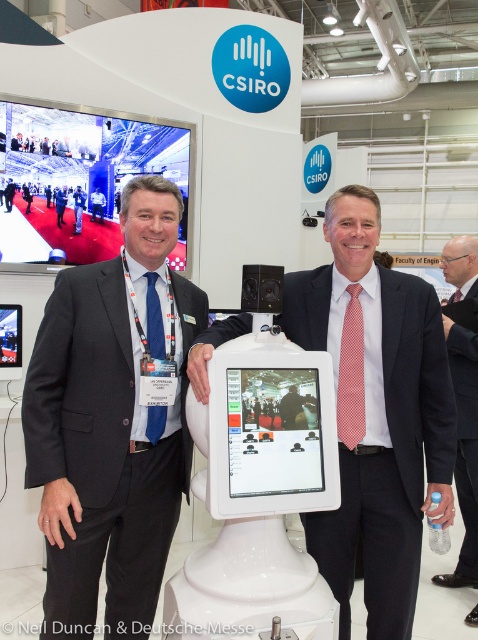
Question: Which point appears farthest from the camera in this image?

Choices:
 (A) (391, 356)
 (B) (11, 179)
 (C) (42, 404)
 (D) (58, 211)

Answer: (D)

Question: Which object appears closest to the camera in this image?

Choices:
 (A) pink fabric suit at right
 (B) blue suit at center

Answer: (A)

Question: Is the position of pink textured tie at center less distant than that of pink fabric suit at right?

Choices:
 (A) no
 (B) yes

Answer: (B)

Question: Which point is farther from the camera taking this photo?

Choices:
 (A) (8, 209)
 (B) (76, 192)

Answer: (B)

Question: Is pink fabric suit at right bigger than blue suit at center?

Choices:
 (A) no
 (B) yes

Answer: (B)

Question: Observing the image, what is the correct spatial positioning of matte black suit at center in reference to pink fabric suit at right?

Choices:
 (A) below
 (B) above

Answer: (B)